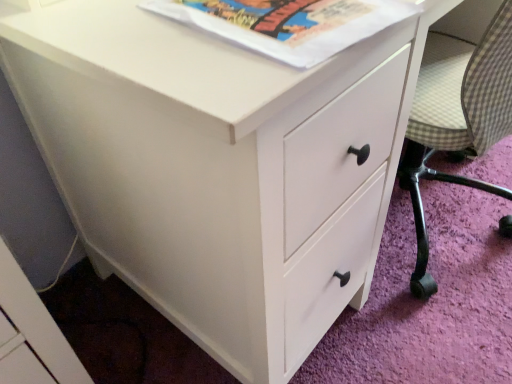
In order to click on vacant space underneath checkered fabric armchair at right (from a real-world perspective) in this screenshot , I will do `click(442, 226)`.